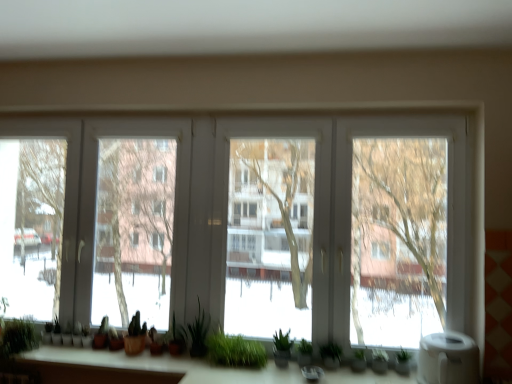
The image size is (512, 384). Identify the location of vacant space to the left of green matte plant at lower left, the fifth plant viewed from the right. (71, 345).